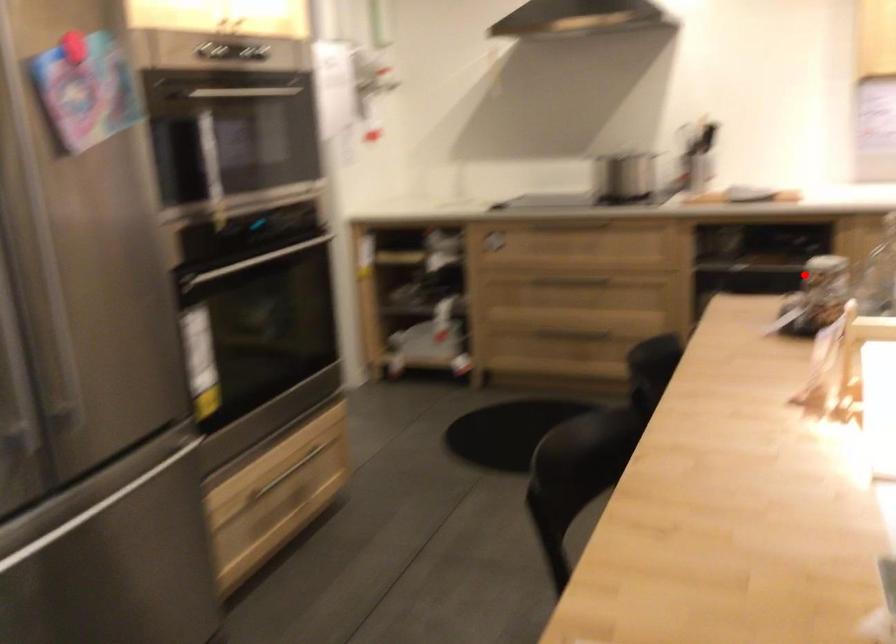
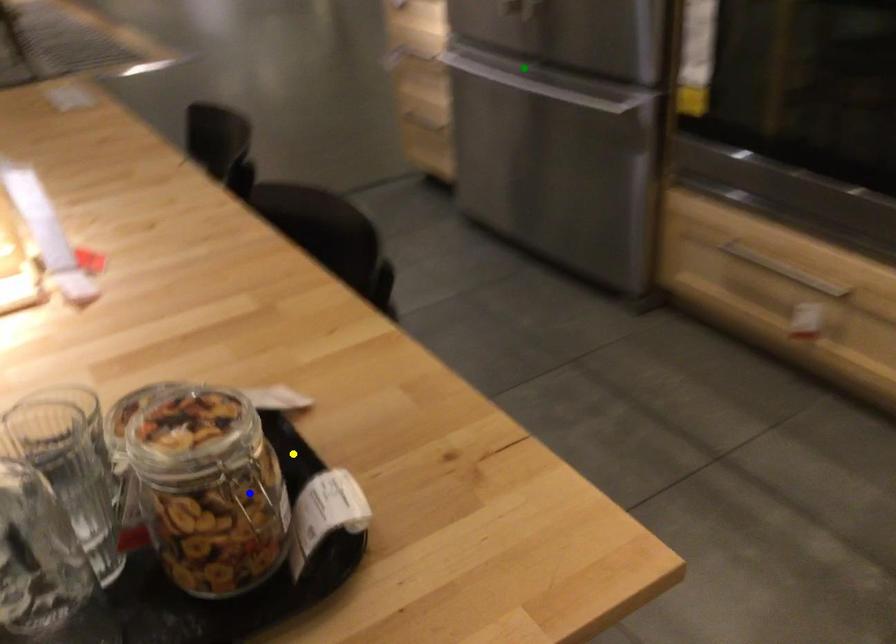
Question: I am providing you with two images of the same scene from different viewpoints. A red point is marked on the first image. You are given multiple points on the second image. Which spot in image 2 lines up with the point in image 1?

Choices:
 (A) green point
 (B) yellow point
 (C) blue point

Answer: (C)